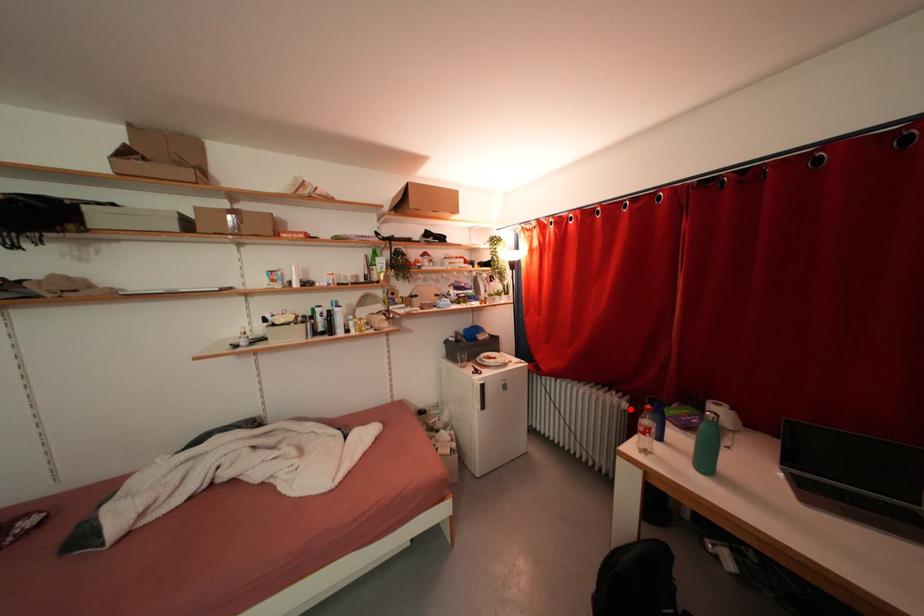
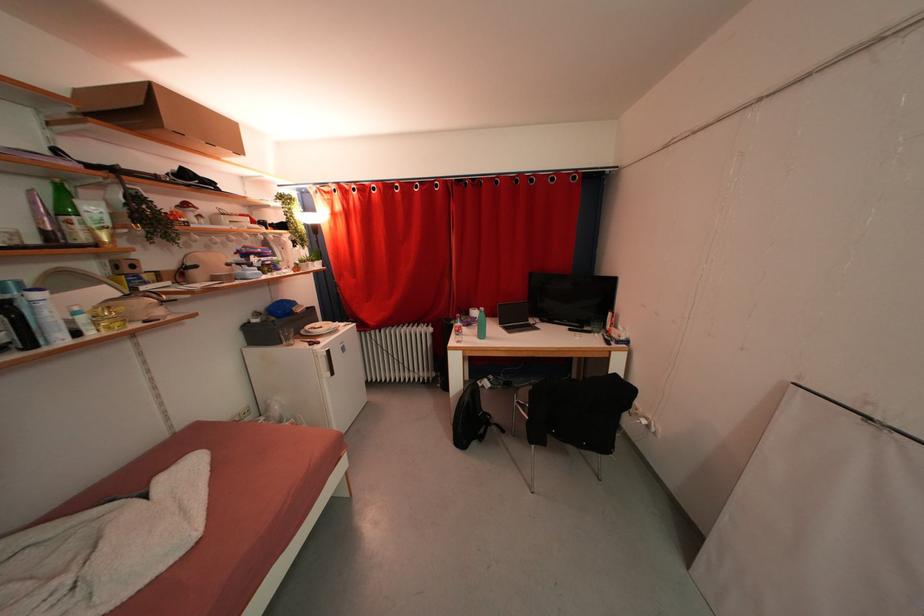
Where in the second image is the point corresponding to the highlighted location from the first image?

(436, 333)